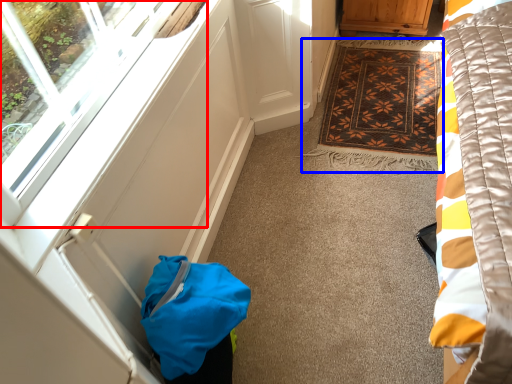
Question: Which object is closer to the camera taking this photo, window (highlighted by a red box) or mat (highlighted by a blue box)?

Choices:
 (A) window
 (B) mat

Answer: (A)